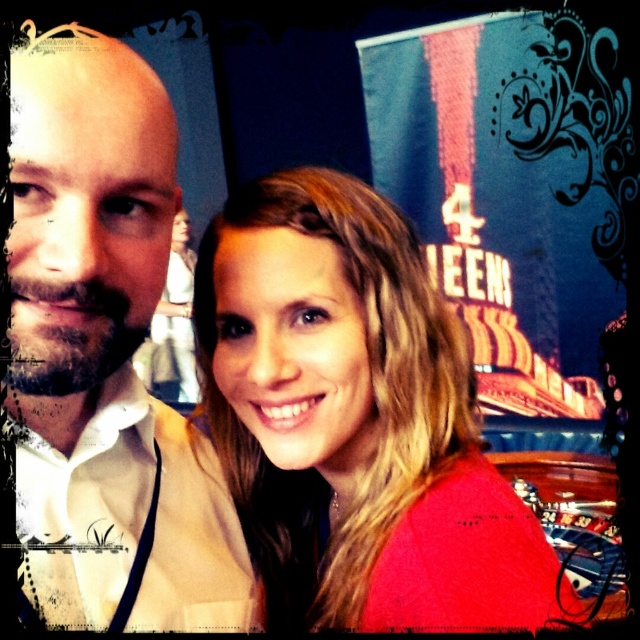
Between white shirt at center and smooth beige dress at center, which one has more height?

With more height is smooth beige dress at center.

Does point (148, 113) come farther from viewer compared to point (156, 330)?

No, (148, 113) is closer to viewer.

At what (x,y) coordinates should I click in order to perform the action: click on white shirt at center. Please return your answer as a coordinate pair (x, y). The width and height of the screenshot is (640, 640). Looking at the image, I should click on (104, 355).

Who is taller, smooth red shirt at center or smooth beige dress at center?

Standing taller between the two is smooth beige dress at center.

Is point (241, 205) in front of point (188, 234)?

Yes, point (241, 205) is closer to viewer.

Where is `smooth red shirt at center`? This screenshot has height=640, width=640. smooth red shirt at center is located at coordinates (355, 419).

Can you confirm if smooth red shirt at center is positioned above white shirt at center?

Actually, smooth red shirt at center is below white shirt at center.

Identify the location of smooth red shirt at center. (355, 419).